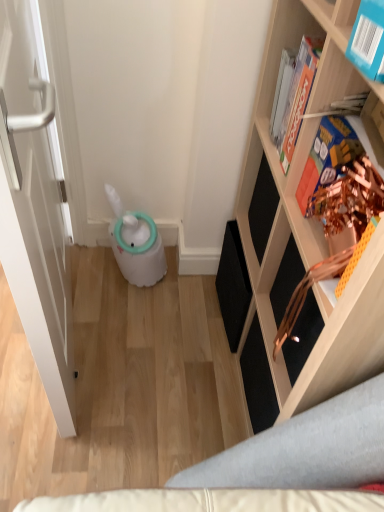
Question: Is blue cardboard book at upper right, acting as the third book starting from the back, shorter than hardcover book at upper right, the 1th book when ordered from back to front?

Choices:
 (A) no
 (B) yes

Answer: (B)

Question: Is blue cardboard book at upper right, acting as the third book starting from the back, wider than hardcover book at upper right, which ranks as the third book in front-to-back order?

Choices:
 (A) yes
 (B) no

Answer: (A)

Question: Is blue cardboard book at upper right, acting as the third book starting from the back, surrounding hardcover book at upper right, which ranks as the third book in front-to-back order?

Choices:
 (A) yes
 (B) no

Answer: (B)

Question: From the image's perspective, is blue cardboard book at upper right, which is counted as the first book, starting from the front, under hardcover book at upper right, which ranks as the third book in front-to-back order?

Choices:
 (A) no
 (B) yes

Answer: (B)

Question: Does blue cardboard book at upper right, acting as the third book starting from the back, have a lesser width compared to hardcover book at upper right, the 1th book when ordered from back to front?

Choices:
 (A) no
 (B) yes

Answer: (A)

Question: Relative to blue cardboard book at upper right, which is counted as the first book, starting from the front, is hardcover book at upper right, the 1th book when ordered from back to front, in front or behind?

Choices:
 (A) front
 (B) behind

Answer: (B)

Question: Choose the correct answer: Is hardcover book at upper right, which ranks as the third book in front-to-back order, inside blue cardboard book at upper right, acting as the third book starting from the back, or outside it?

Choices:
 (A) inside
 (B) outside

Answer: (B)

Question: From a real-world perspective, is hardcover book at upper right, which ranks as the third book in front-to-back order, physically located above or below blue cardboard book at upper right, which is counted as the first book, starting from the front?

Choices:
 (A) below
 (B) above

Answer: (A)

Question: Is hardcover book at upper right, the 1th book when ordered from back to front, taller or shorter than blue cardboard book at upper right, acting as the third book starting from the back?

Choices:
 (A) tall
 (B) short

Answer: (A)

Question: Considering their positions, is wooden shelf at right located in front of or behind hardcover book at upper right, the 1th book when ordered from back to front?

Choices:
 (A) behind
 (B) front

Answer: (B)

Question: From the image's perspective, is wooden shelf at right positioned above or below hardcover book at upper right, which ranks as the third book in front-to-back order?

Choices:
 (A) above
 (B) below

Answer: (B)

Question: Looking at the image, does wooden shelf at right seem bigger or smaller compared to hardcover book at upper right, which ranks as the third book in front-to-back order?

Choices:
 (A) small
 (B) big

Answer: (B)

Question: From a real-world perspective, is wooden shelf at right physically located above or below hardcover book at upper right, which ranks as the third book in front-to-back order?

Choices:
 (A) below
 (B) above

Answer: (A)

Question: Considering their positions, is metallic gold book at upper right, the 2th book when ordered from front to back, located in front of or behind blue cardboard book at upper right, which is counted as the first book, starting from the front?

Choices:
 (A) front
 (B) behind

Answer: (B)

Question: From a real-world perspective, is metallic gold book at upper right, the second book when ordered from back to front, above or below blue cardboard book at upper right, acting as the third book starting from the back?

Choices:
 (A) above
 (B) below

Answer: (B)